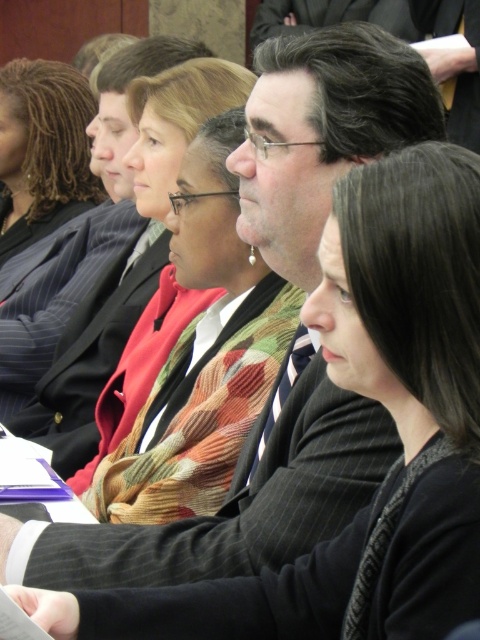
Between knitted scarf at center and matte black suit at upper left, which one has more height?

With more height is matte black suit at upper left.

Between point (190, 170) and point (36, 147), which one is positioned in front?

Point (190, 170)

Where is `knitted scarf at center`? knitted scarf at center is located at coordinates (202, 355).

The image size is (480, 640). I want to click on knitted scarf at center, so click(x=202, y=355).